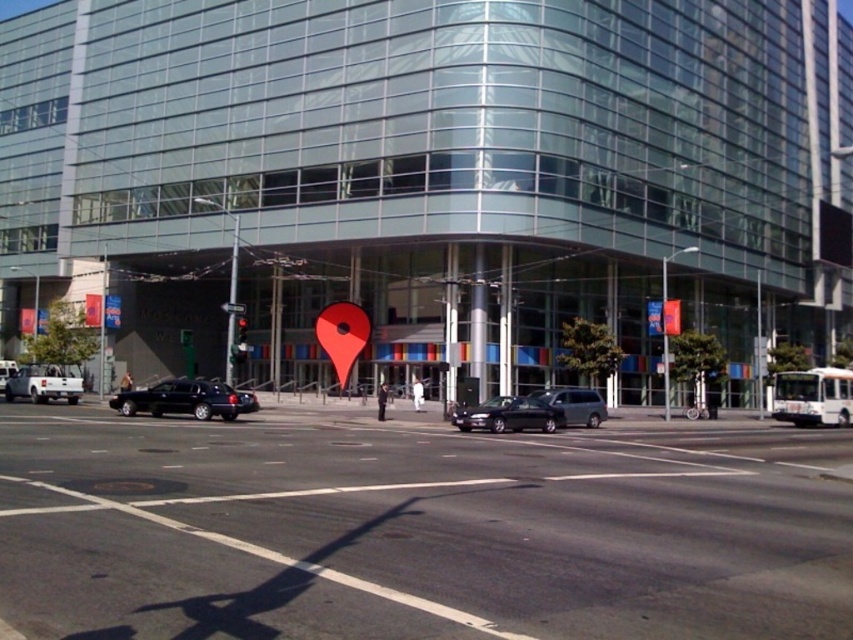
From the picture: Does black asphalt at center appear over shiny black sedan at center?

Yes, black asphalt at center is above shiny black sedan at center.

Which of these two, black asphalt at center or shiny black sedan at center, stands shorter?

With less height is shiny black sedan at center.

Describe the element at coordinates (418, 529) in the screenshot. I see `black asphalt at center` at that location.

You are a GUI agent. You are given a task and a screenshot of the screen. Output one action in this format:
    pyautogui.click(x=<x>, y=<y>)
    Task: Click on the black asphalt at center
    The image size is (853, 640).
    Given the screenshot: What is the action you would take?
    pyautogui.click(x=418, y=529)

Between white matte truck at lower left and red glass traffic light at center, which one appears on the right side from the viewer's perspective?

Positioned to the right is red glass traffic light at center.

Identify the location of white matte truck at lower left. This screenshot has height=640, width=853. (44, 384).

Locate an element on the screen. This screenshot has height=640, width=853. white matte truck at lower left is located at coordinates (44, 384).

Can you confirm if black asphalt at center is positioned to the left of red glass traffic light at center?

Incorrect, black asphalt at center is not on the left side of red glass traffic light at center.

Is black asphalt at center further to the viewer compared to red glass traffic light at center?

No, it is not.

Between point (84, 552) and point (241, 323), which one is positioned behind?

The point (241, 323) is more distant.

This screenshot has height=640, width=853. Identify the location of black asphalt at center. (418, 529).